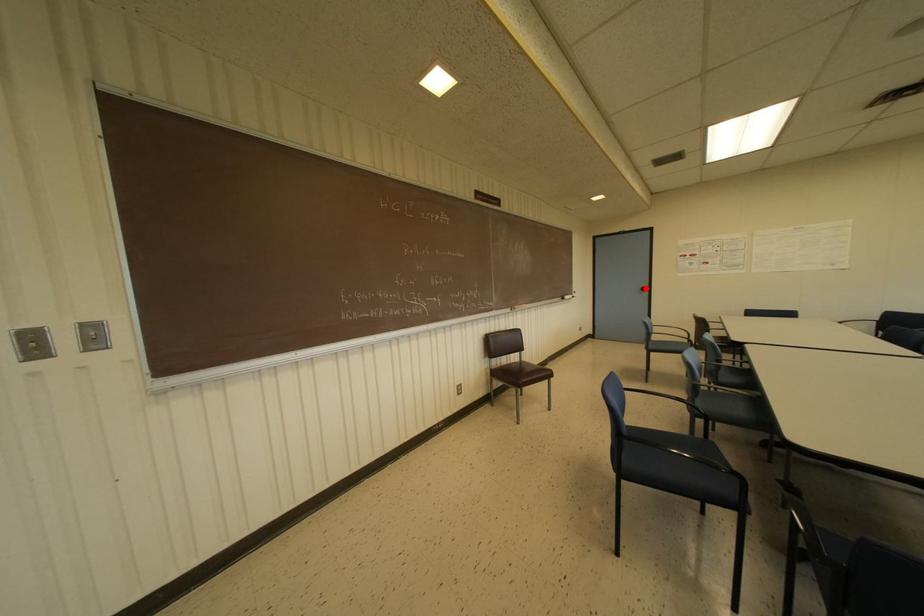
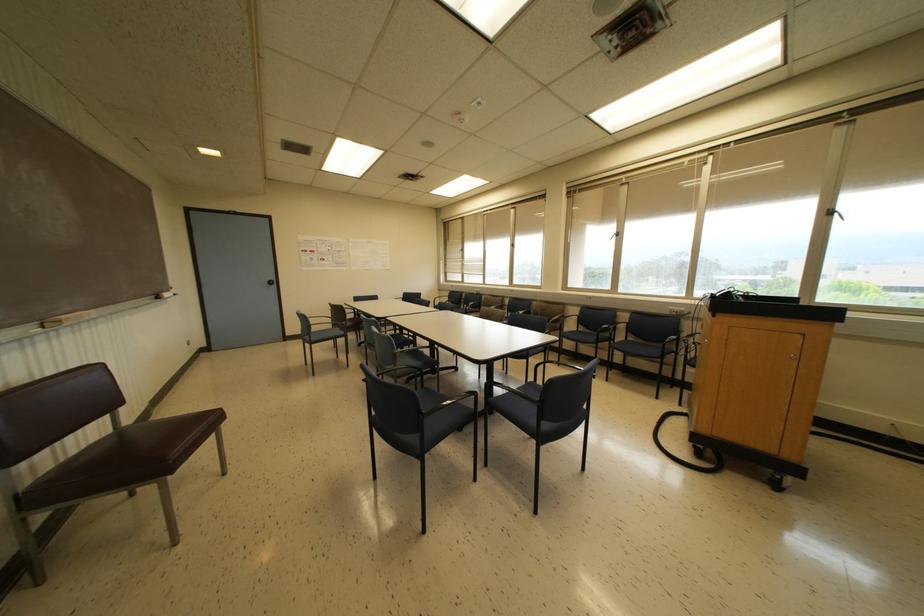
Locate, in the second image, the point that corresponds to the highlighted location in the first image.

(274, 282)